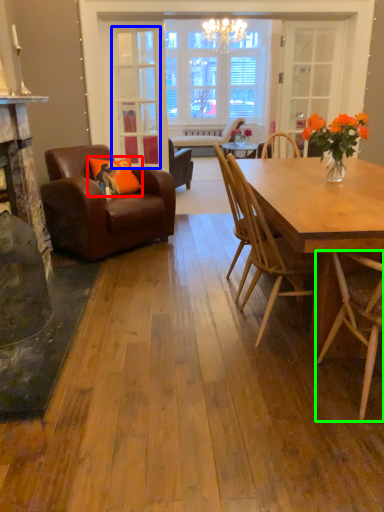
Question: Based on their relative distances, which object is farther from pillow (highlighted by a red box)? Choose from glass door (highlighted by a blue box) and chair (highlighted by a green box).

Choices:
 (A) glass door
 (B) chair

Answer: (B)